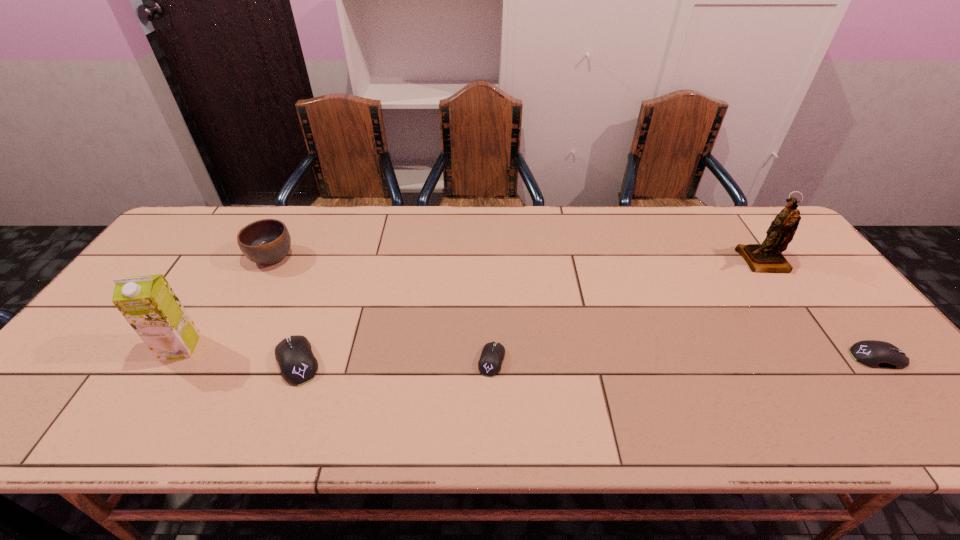
If the aim is uniform spacing by inserting an additional mouse_(computer_equipment) among them, please point to a vacant space for this new mouse_(computer_equipment). Please provide its 2D coordinates. Your answer should be formatted as a tuple, i.e. [(x, y)], where the tuple contains the x and y coordinates of a point satisfying the conditions above.

[(685, 359)]